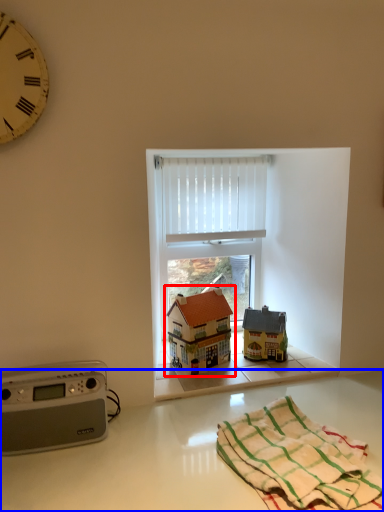
Question: Which of the following is the farthest to the observer, toy (highlighted by a red box) or counter top (highlighted by a blue box)?

Choices:
 (A) toy
 (B) counter top

Answer: (A)